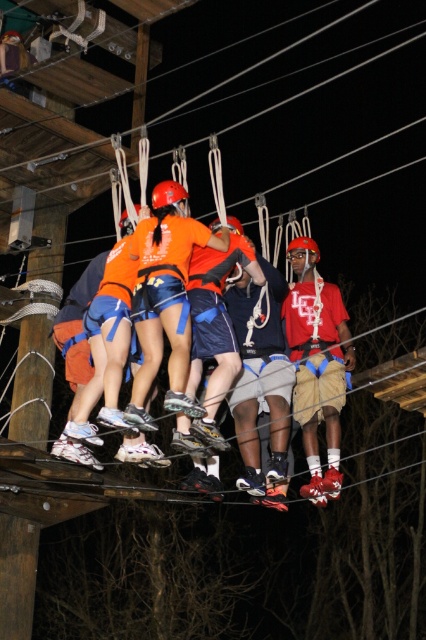
You are an observer looking at the group of people on the suspended wooden platform. Which item is positioned to the right of the other between the orange fabric shirt at center and the orange fabric shorts at center?

A: The orange fabric shirt at center is positioned to the right of the orange fabric shorts at center.

From the picture: You are standing on the suspended wooden platform and notice two points marked on the platform. The first point is at coordinates point (x=232, y=253) and the second is at point (x=244, y=428). Which point is closer to you?

Point (x=232, y=253) is closer to you because it is further to the viewer than point (x=244, y=428).